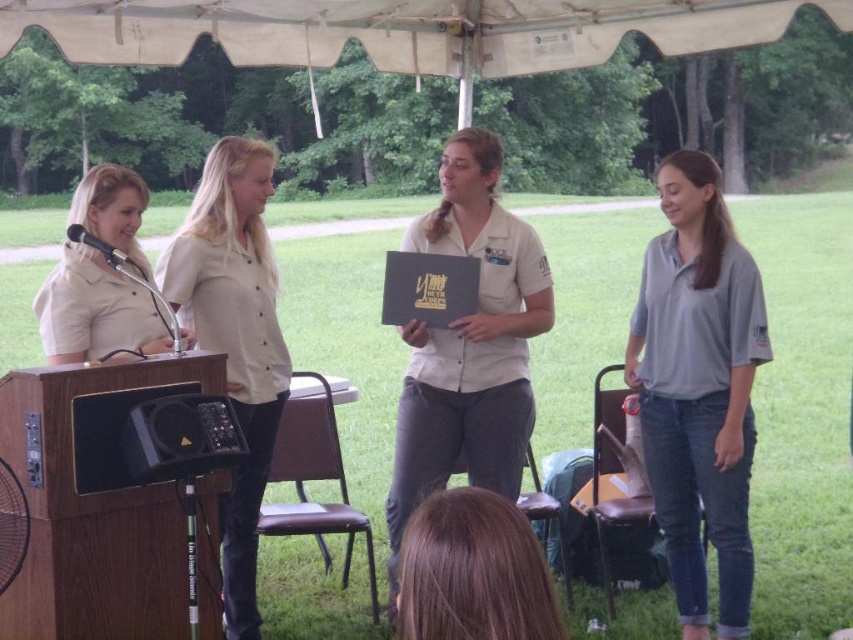
Who is more distant from viewer, (115, 241) or (97, 248)?

The point (115, 241) is behind.

Who is lower down, matte khaki shirt at left or matte black microphone at left?

matte khaki shirt at left is lower down.

Is point (84, 220) positioned after point (115, 260)?

Yes, point (84, 220) is behind point (115, 260).

Locate an element on the screen. The image size is (853, 640). matte khaki shirt at left is located at coordinates (94, 310).

Is white fabric canopy at upper center wider than matte white shirt at center?

Yes, white fabric canopy at upper center is wider than matte white shirt at center.

Between point (67, 20) and point (532, 268), which one is positioned behind?

The point (67, 20) is more distant.

This screenshot has width=853, height=640. What are the coordinates of `white fabric canopy at upper center` in the screenshot? It's located at (401, 29).

Between matte white blouse at center and brown hair at lower center, which one is positioned higher?

matte white blouse at center is above.

Can you confirm if matte white blouse at center is thinner than brown hair at lower center?

No.

Does point (252, 481) come closer to viewer compared to point (461, 598)?

No.

Find the location of a particular element. The image size is (853, 640). matte white blouse at center is located at coordinates (234, 339).